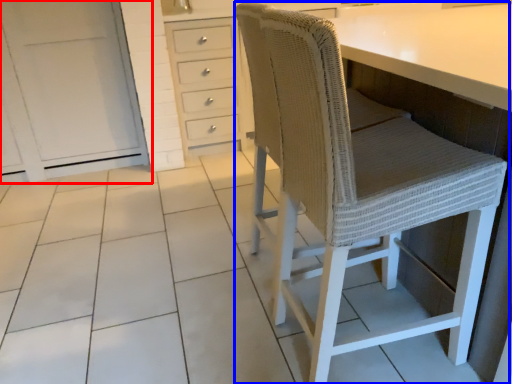
Question: Among these objects, which one is farthest to the camera, cabinetry (highlighted by a red box) or chair (highlighted by a blue box)?

Choices:
 (A) cabinetry
 (B) chair

Answer: (A)